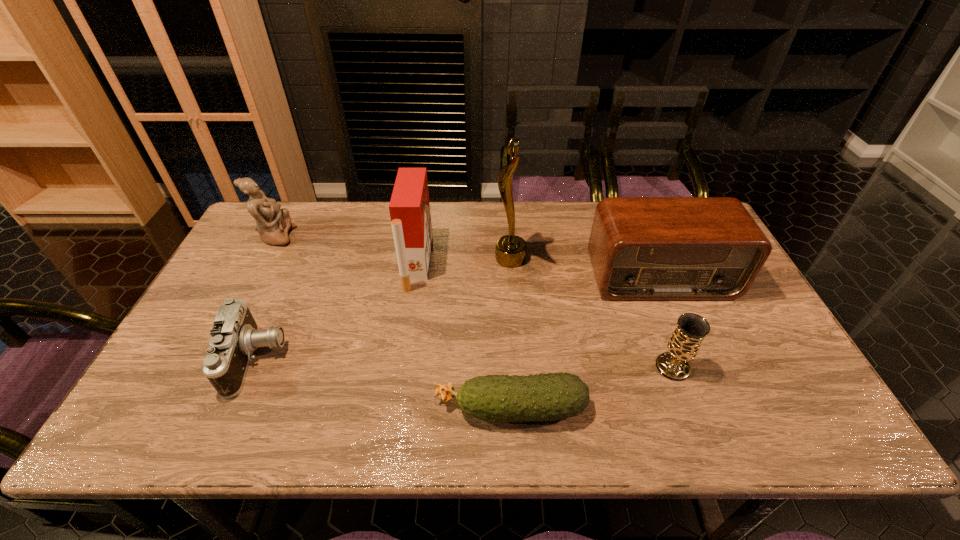
Locate an element on the screen. The width and height of the screenshot is (960, 540). vacant space situated 0.090m on the front-facing side of the tallest object is located at coordinates (466, 259).

This screenshot has height=540, width=960. I want to click on vacant space located 0.330m on the front-facing side of the cigarette case, so click(x=539, y=264).

Find the location of `vacant space located 0.260m on the front-facing side of the figurine`. vacant space located 0.260m on the front-facing side of the figurine is located at coordinates (373, 237).

The image size is (960, 540). I want to click on free region located on the front panel of the radio receiver, so click(701, 372).

Locate an element on the screen. Image resolution: width=960 pixels, height=540 pixels. vacant area situated on the left of the fifth tallest object is located at coordinates (578, 367).

You are a GUI agent. You are given a task and a screenshot of the screen. Output one action in this format:
    pyautogui.click(x=<x>, y=<y>)
    Task: Click on the free location located at the lens of the camera
    The height and width of the screenshot is (540, 960).
    Given the screenshot: What is the action you would take?
    pyautogui.click(x=373, y=359)

The image size is (960, 540). I want to click on free space located at the blossom end of the shortest object, so click(x=324, y=408).

Identify the location of free location located at the blossom end of the shortest object. The height and width of the screenshot is (540, 960). (364, 408).

At what (x,y) coordinates should I click in order to perform the action: click on vacant space located at the blossom end of the shortest object. Please return your answer as a coordinate pair (x, y). Looking at the image, I should click on (276, 408).

Locate an element on the screen. Image resolution: width=960 pixels, height=540 pixels. award that is at the far edge is located at coordinates (510, 250).